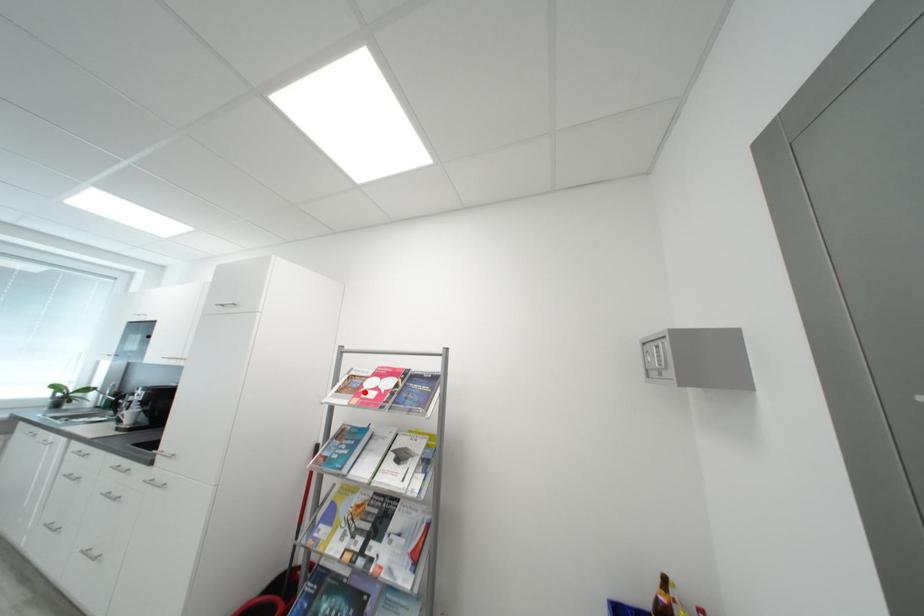
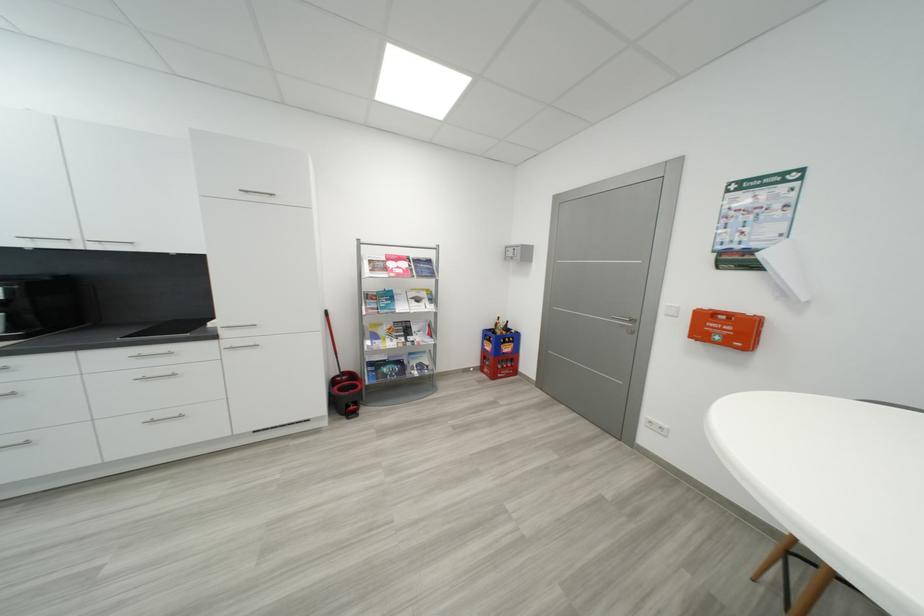
In the second image, find the point that corresponds to the highlighted location in the first image.

(393, 270)